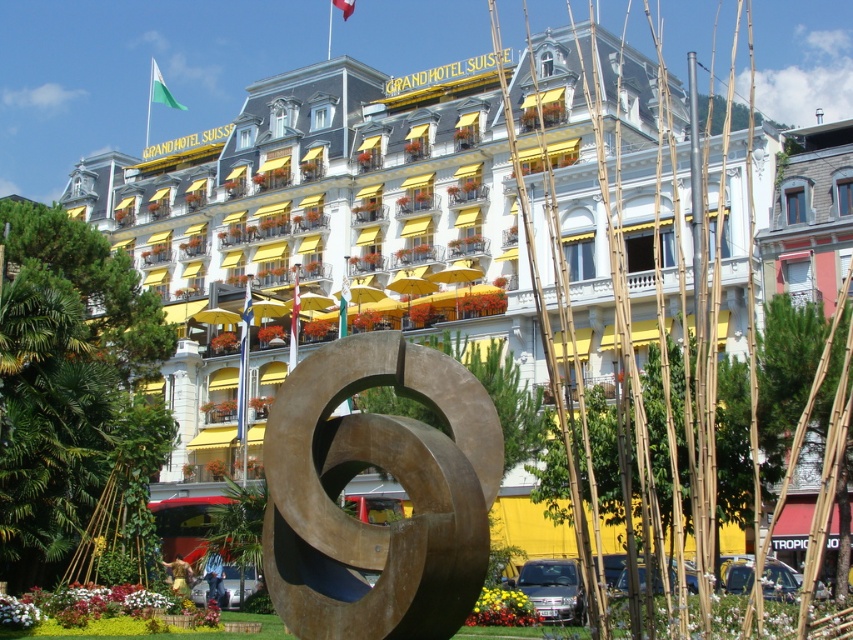
Is white stone building at center to the right of bronze sculpture at center from the viewer's perspective?

Incorrect, white stone building at center is not on the right side of bronze sculpture at center.

Describe the element at coordinates (337, 198) in the screenshot. This screenshot has height=640, width=853. I see `white stone building at center` at that location.

Which is behind, point (675, 241) or point (323, 612)?

Point (675, 241)

Locate an element on the screen. white stone building at center is located at coordinates (337, 198).